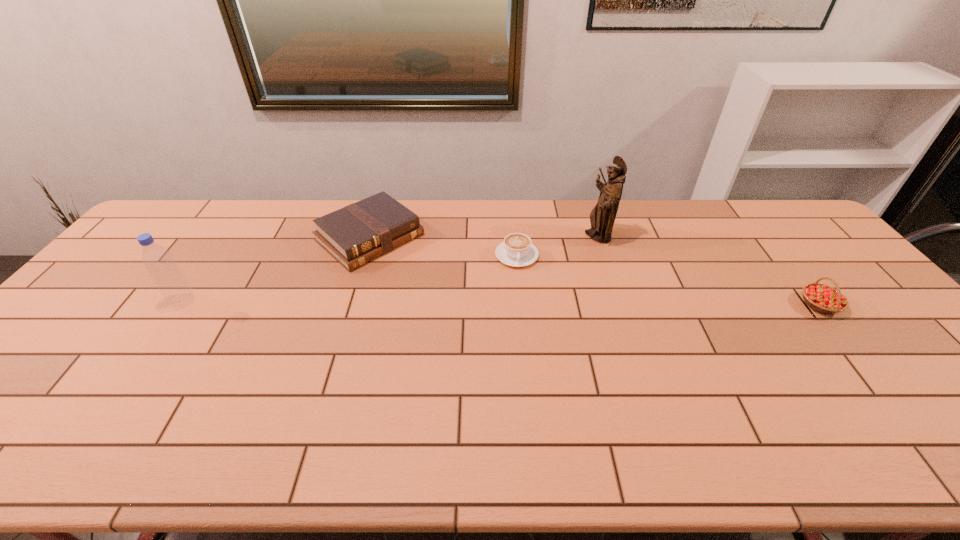
Identify the location of vacant space located on the front-facing side of the figurine. This screenshot has width=960, height=540. (515, 298).

Image resolution: width=960 pixels, height=540 pixels. In order to click on vacant space situated 0.400m on the front-facing side of the figurine in this screenshot , I will do `click(505, 305)`.

Where is `free space located 0.340m on the front-facing side of the figurine`? Image resolution: width=960 pixels, height=540 pixels. free space located 0.340m on the front-facing side of the figurine is located at coordinates (519, 294).

The image size is (960, 540). I want to click on vacant space located 0.360m on the side of the cappuccino with the handle, so click(x=530, y=368).

You are a GUI agent. You are given a task and a screenshot of the screen. Output one action in this format:
    pyautogui.click(x=<x>, y=<y>)
    Task: Click on the free spot located 0.160m on the side of the cappuccino with the handle
    The image size is (960, 540).
    Given the screenshot: What is the action you would take?
    pyautogui.click(x=522, y=308)

Find the location of a particular element. blank space located on the side of the cappuccino with the handle is located at coordinates (528, 351).

This screenshot has height=540, width=960. I want to click on free location located 0.160m on the spine side of the Bible, so click(435, 289).

You are a GUI agent. You are given a task and a screenshot of the screen. Output one action in this format:
    pyautogui.click(x=<x>, y=<y>)
    Task: Click on the free space located 0.250m on the spine side of the Bible
    The width and height of the screenshot is (960, 540).
    Given the screenshot: What is the action you would take?
    pyautogui.click(x=455, y=305)

Image resolution: width=960 pixels, height=540 pixels. Identify the location of free space located on the spine side of the Bible. (492, 335).

Image resolution: width=960 pixels, height=540 pixels. Find the location of `figurine at the far edge`. figurine at the far edge is located at coordinates (602, 217).